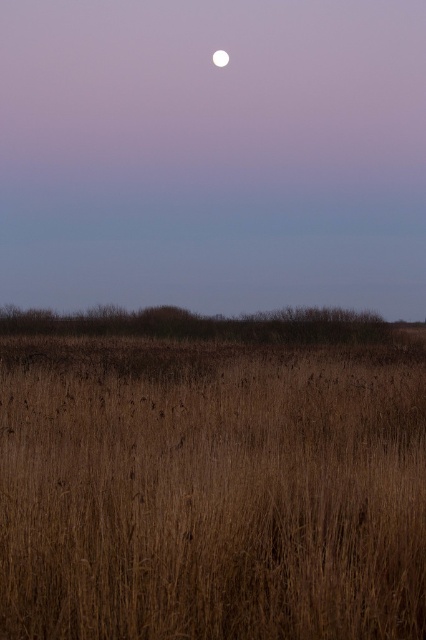
From the picture: Measure the distance between brown dry grass at center and white glossy moon at upper center.

150.83 feet

Which is in front, point (245, 369) or point (226, 58)?

Positioned in front is point (245, 369).

Describe the element at coordinates (210, 490) in the screenshot. I see `brown dry grass at center` at that location.

At what (x,y) coordinates should I click in order to perform the action: click on brown dry grass at center. Please return your answer as a coordinate pair (x, y). The image size is (426, 640). Looking at the image, I should click on (210, 490).